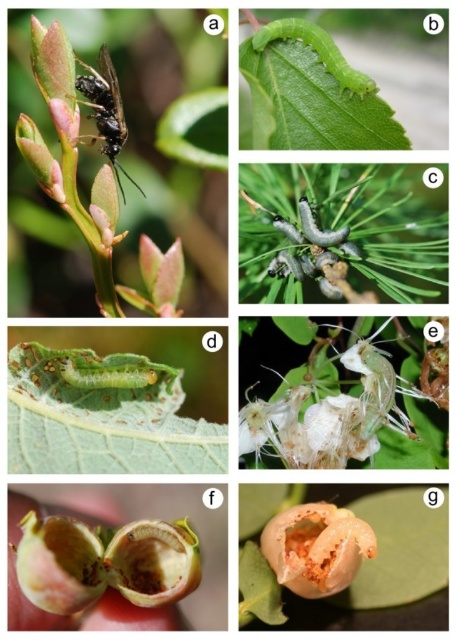
You are standing in front of panel B of the image. There are two points marked on the panel at coordinates point (321, 586) and point (92, 90). From your perspective, which point is closer to you?

Point (321, 586) is in front of point (92, 90), so it is closer to you.

In panel B, there are two points marked at coordinates point [358,552] and point [337,72]. From the viewer perspective, which point is closer to you?

Point [358,552] is in front of point [337,72], so it is closer to the viewer.